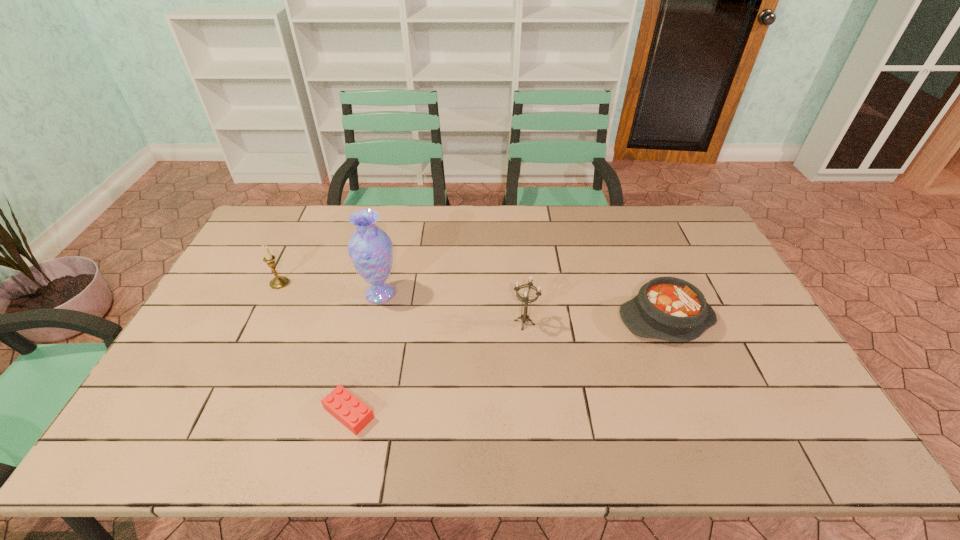
The width and height of the screenshot is (960, 540). In order to click on free space between the vase and the nearest object in this screenshot , I will do `click(365, 353)`.

Find the location of a particular element. free spot between the fourth object from left to right and the tallest object is located at coordinates (452, 308).

This screenshot has height=540, width=960. What are the coordinates of `free spot between the Lego and the left candle holder` in the screenshot? It's located at (314, 348).

This screenshot has height=540, width=960. What are the coordinates of `the second closest object to the nearer candle holder` in the screenshot? It's located at (370, 248).

Identify the location of object that is the second closest to the tallest object. This screenshot has width=960, height=540. (355, 415).

Locate an element on the screen. The height and width of the screenshot is (540, 960). free spot that satisfies the following two spatial constraints: 1. on the back side of the nearer candle holder; 2. on the left side of the second shortest object is located at coordinates (524, 319).